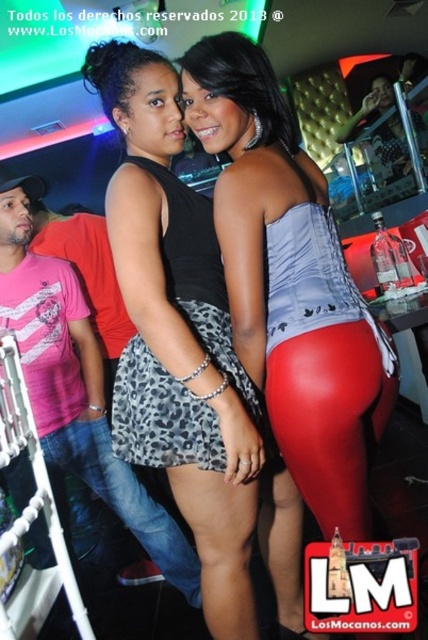
Is leopard print skirt at center to the left of leopard print fabric skirt at center from the viewer's perspective?

A: Indeed, leopard print skirt at center is positioned on the left side of leopard print fabric skirt at center.

Who is higher up, leopard print skirt at center or leopard print fabric skirt at center?

leopard print skirt at center is above.

Does point (124, 413) come farther from viewer compared to point (128, 460)?

No.

Find the location of a particular element. leopard print skirt at center is located at coordinates (178, 333).

Which is below, leopard print skirt at lower center or black leopard print dress at center?

Positioned lower is leopard print skirt at lower center.

Does leopard print skirt at lower center have a lesser width compared to black leopard print dress at center?

Incorrect, leopard print skirt at lower center's width is not less than black leopard print dress at center's.

Measure the distance between leopard print skirt at lower center and camera.

leopard print skirt at lower center is 5.37 feet away from camera.

Where is `leopard print skirt at lower center`? leopard print skirt at lower center is located at coordinates (121, 499).

Can you confirm if leopard print skirt at center is positioned to the left of pink striped t-shirt at left?

In fact, leopard print skirt at center is to the right of pink striped t-shirt at left.

Does leopard print skirt at center have a greater width compared to pink striped t-shirt at left?

In fact, leopard print skirt at center might be narrower than pink striped t-shirt at left.

Measure the distance between point (190,499) and camera.

They are 1.19 meters apart.

I want to click on leopard print skirt at center, so click(178, 333).